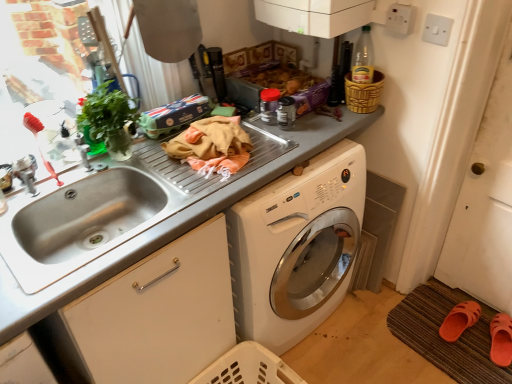
The width and height of the screenshot is (512, 384). I want to click on free point above brown woven mat at lower right (from a real-world perspective), so click(x=457, y=334).